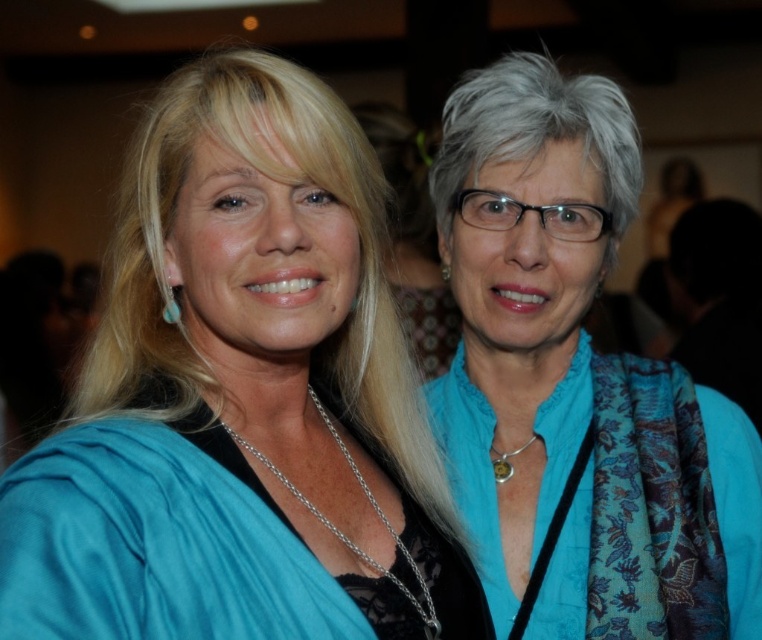
Question: Which point is farther from the camera taking this photo?

Choices:
 (A) (440, 272)
 (B) (514, 156)
 (C) (200, 458)

Answer: (A)

Question: Is blue silk blouse at center thinner than blue silk scarf at upper right?

Choices:
 (A) no
 (B) yes

Answer: (B)

Question: Is blue silk blouse at center thinner than teal gemstone earring at upper center?

Choices:
 (A) no
 (B) yes

Answer: (A)

Question: Can you confirm if blue silk scarf at upper right is positioned to the right of teal gemstone earring at upper center?

Choices:
 (A) yes
 (B) no

Answer: (A)

Question: Among these points, which one is nearest to the camera?

Choices:
 (A) (450, 273)
 (B) (751, 554)

Answer: (B)

Question: Among these points, which one is farthest from the camera?

Choices:
 (A) (157, 321)
 (B) (498, 285)
 (C) (444, 266)

Answer: (C)